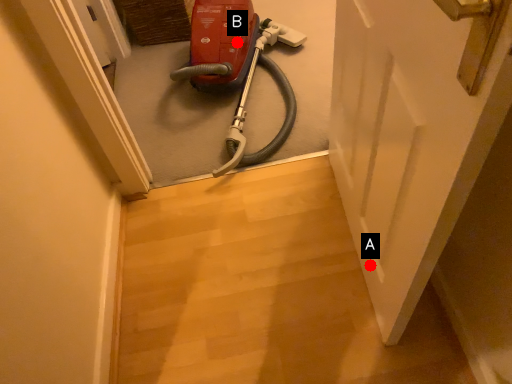
Question: Two points are circled on the image, labeled by A and B beside each circle. Which of the following is the closest to the observer?

Choices:
 (A) A is closer
 (B) B is closer

Answer: (A)